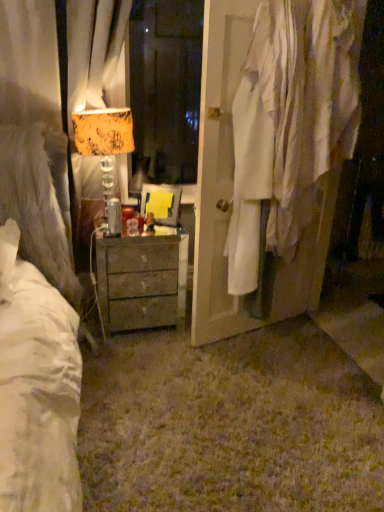
Find the location of a particular element. This screenshot has width=384, height=512. vacant space underneath white fabric at right (from a real-world perspective) is located at coordinates (282, 332).